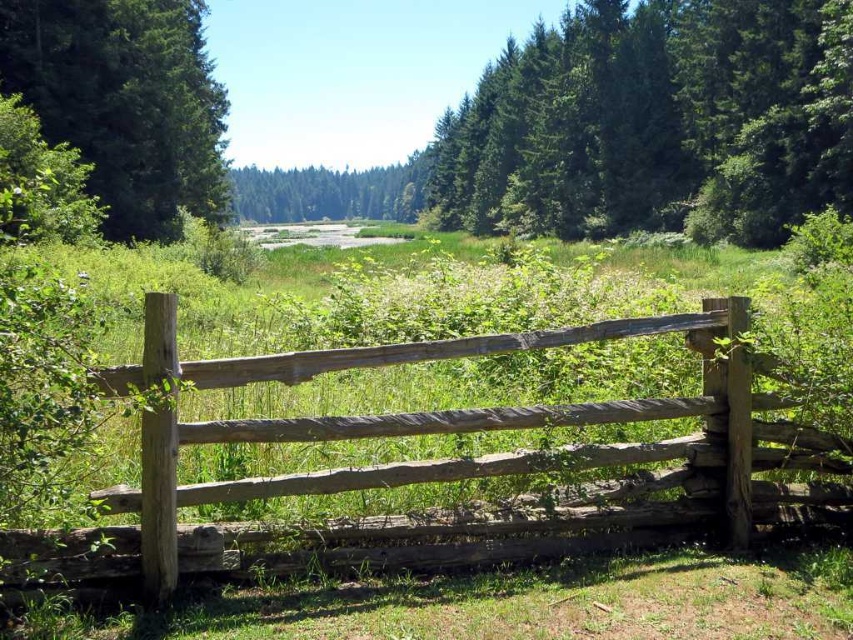
Who is lower down, weathered wood fence at center or green textured tree at upper left?

Positioned lower is weathered wood fence at center.

Consider the image. Does weathered wood fence at center appear on the left side of green textured tree at upper left?

No, weathered wood fence at center is not to the left of green textured tree at upper left.

What do you see at coordinates (432, 461) in the screenshot?
I see `weathered wood fence at center` at bounding box center [432, 461].

At what (x,y) coordinates should I click in order to perform the action: click on weathered wood fence at center. Please return your answer as a coordinate pair (x, y). The width and height of the screenshot is (853, 640). Looking at the image, I should click on (432, 461).

Who is lower down, weathered wood fence at center or green matte tree at center?

weathered wood fence at center is lower down.

Between point (195, 428) and point (395, 173), which one is positioned in front?

Positioned in front is point (195, 428).

Is point (762, 516) positioned in front of point (241, 188)?

Yes, it is.

At what (x,y) coordinates should I click in order to perform the action: click on weathered wood fence at center. Please return your answer as a coordinate pair (x, y). Looking at the image, I should click on (432, 461).

This screenshot has height=640, width=853. What do you see at coordinates (656, 122) in the screenshot?
I see `green textured tree at upper center` at bounding box center [656, 122].

Can you confirm if green textured tree at upper center is positioned above green textured tree at upper left?

Yes, green textured tree at upper center is above green textured tree at upper left.

Locate an element on the screen. This screenshot has height=640, width=853. green textured tree at upper center is located at coordinates (656, 122).